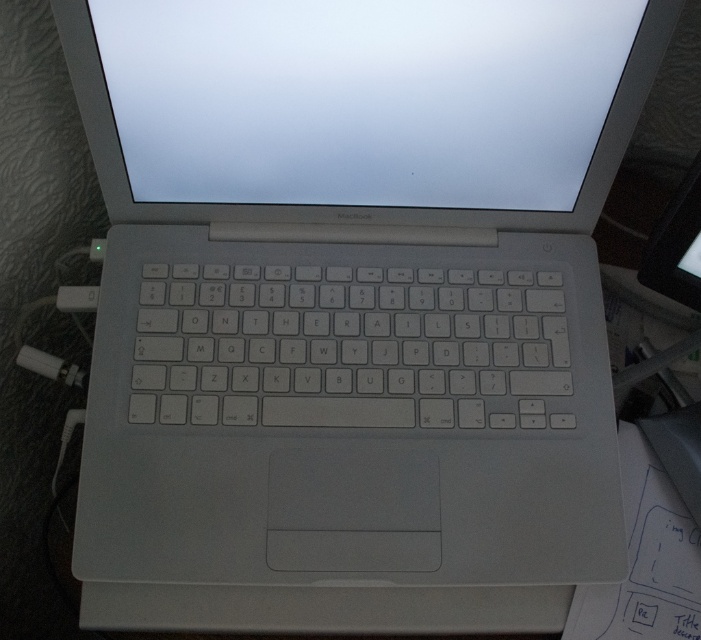
Does white plastic keyboard at center have a lesser width compared to white plastic plug at lower left?

No.

Who is more forward, [519,326] or [67,374]?

Point [519,326]

You are a GUI agent. You are given a task and a screenshot of the screen. Output one action in this format:
    pyautogui.click(x=<x>, y=<y>)
    Task: Click on the white plastic keyboard at center
    
    Given the screenshot: What is the action you would take?
    pyautogui.click(x=346, y=346)